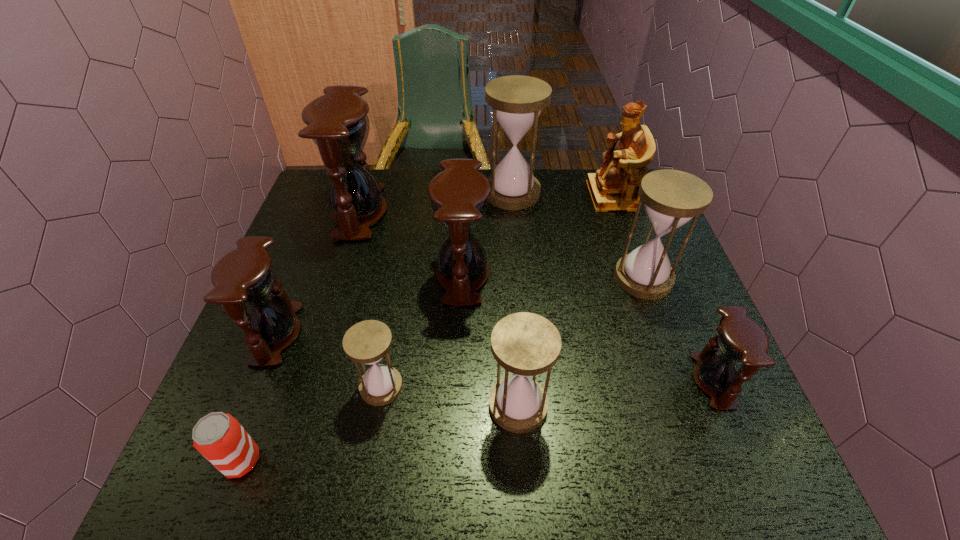
The image size is (960, 540). What are the coordinates of `white hourglass that can be found as the second closest to the biggest white hourglass` in the screenshot? It's located at (367, 342).

Select which white hourglass is the third closest to the rightmost white hourglass. Please provide its 2D coordinates. Your answer should be formatted as a tuple, i.e. [(x, y)], where the tuple contains the x and y coordinates of a point satisfying the conditions above.

[(367, 342)]

This screenshot has width=960, height=540. I want to click on vacant space that satisfies the following two spatial constraints: 1. on the front side of the seventh object from right to left; 2. on the left side of the biggest brown hourglass, so click(x=306, y=387).

Where is `blank area in the image that satisfies the following two spatial constraints: 1. on the front side of the rightmost brown hourglass; 2. on the right side of the farthest brown hourglass`? blank area in the image that satisfies the following two spatial constraints: 1. on the front side of the rightmost brown hourglass; 2. on the right side of the farthest brown hourglass is located at coordinates (308, 381).

Locate an element on the screen. Image resolution: width=960 pixels, height=540 pixels. free space that satisfies the following two spatial constraints: 1. on the front side of the farthest brown hourglass; 2. on the right side of the leftmost white hourglass is located at coordinates (306, 387).